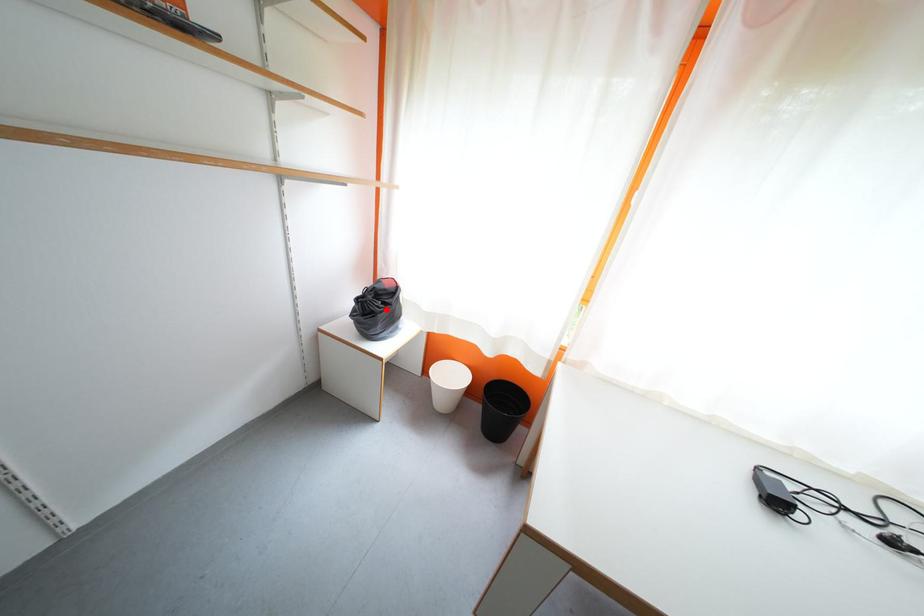
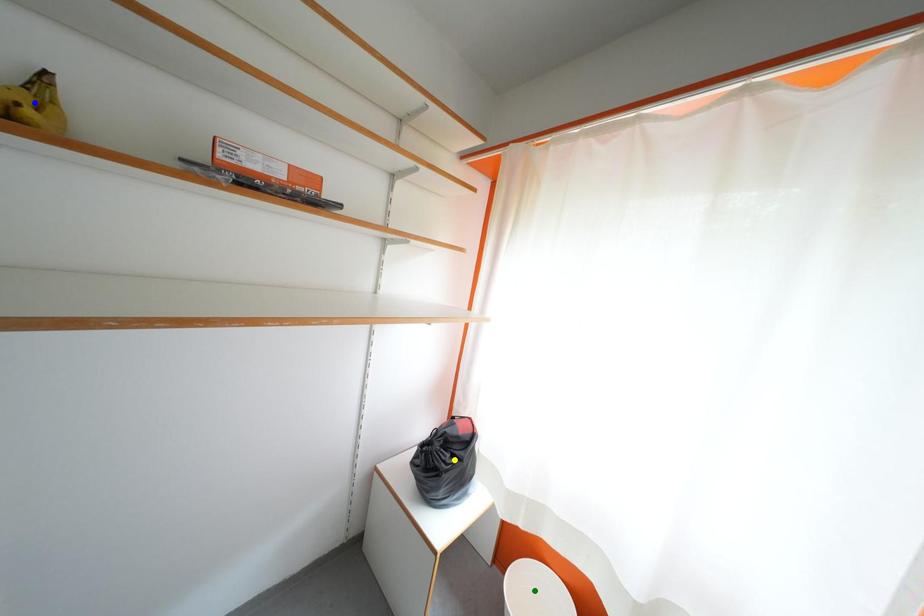
Question: I am providing you with two images of the same scene from different viewpoints. A red point is marked on the first image. You are given multiple points on the second image. In image 2, which mark is for the same physical point as the one in image 1?

Choices:
 (A) green point
 (B) blue point
 (C) yellow point

Answer: (C)